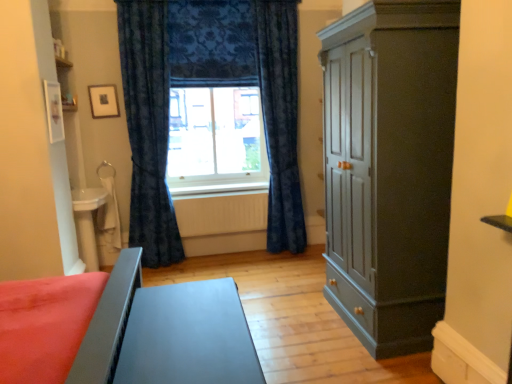
At what (x,y) coordinates should I click in order to perform the action: click on vacant space situated above white painted wood at center (from a real-world perspective). Please return your answer as a coordinate pair (x, y). Looking at the image, I should click on (223, 180).